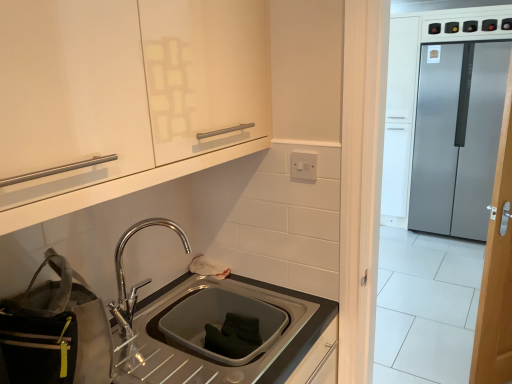
Question: Considering the relative sizes of satin steel sink at lower center and polished chrome tap at lower center in the image provided, is satin steel sink at lower center taller than polished chrome tap at lower center?

Choices:
 (A) no
 (B) yes

Answer: (A)

Question: Is satin steel sink at lower center smaller than polished chrome tap at lower center?

Choices:
 (A) no
 (B) yes

Answer: (A)

Question: Does satin steel sink at lower center have a lesser height compared to polished chrome tap at lower center?

Choices:
 (A) no
 (B) yes

Answer: (B)

Question: Can you confirm if satin steel sink at lower center is wider than polished chrome tap at lower center?

Choices:
 (A) no
 (B) yes

Answer: (B)

Question: Is satin steel sink at lower center positioned far away from polished chrome tap at lower center?

Choices:
 (A) yes
 (B) no

Answer: (B)

Question: From a real-world perspective, is satin silver refrigerator at right above or below matte white cabinet at upper left?

Choices:
 (A) above
 (B) below

Answer: (B)

Question: Is satin silver refrigerator at right inside the boundaries of matte white cabinet at upper left, or outside?

Choices:
 (A) outside
 (B) inside

Answer: (A)

Question: Does point (483, 109) appear closer or farther from the camera than point (56, 188)?

Choices:
 (A) closer
 (B) farther

Answer: (B)

Question: In terms of width, does satin silver refrigerator at right look wider or thinner when compared to matte white cabinet at upper left?

Choices:
 (A) thin
 (B) wide

Answer: (B)

Question: Is matte white cabinet at upper left inside the boundaries of polished chrome tap at lower center, or outside?

Choices:
 (A) inside
 (B) outside

Answer: (B)

Question: From the image's perspective, is matte white cabinet at upper left above or below polished chrome tap at lower center?

Choices:
 (A) above
 (B) below

Answer: (A)

Question: In the image, is matte white cabinet at upper left on the left side or the right side of polished chrome tap at lower center?

Choices:
 (A) right
 (B) left

Answer: (B)

Question: Does point (160, 13) appear closer or farther from the camera than point (133, 299)?

Choices:
 (A) farther
 (B) closer

Answer: (B)

Question: From the image's perspective, is white plastic electric outlet at upper center above or below satin steel sink at lower center?

Choices:
 (A) above
 (B) below

Answer: (A)

Question: Visually, is white plastic electric outlet at upper center positioned to the left or to the right of satin steel sink at lower center?

Choices:
 (A) right
 (B) left

Answer: (A)